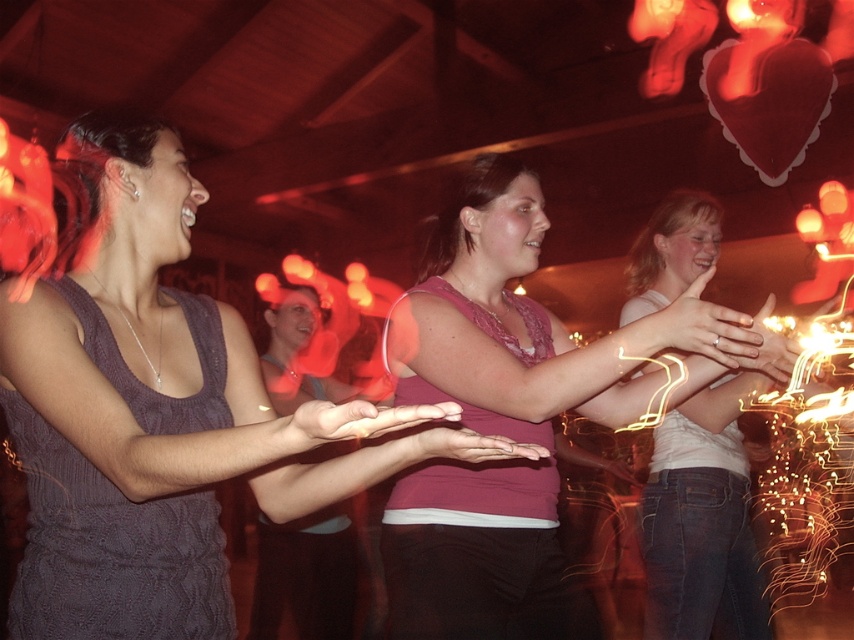
You are at a party and want to take a photo of both the matte purple tank top at center and the pink fabric shirt at center. Which one should you focus on first if you want to capture them in the correct left to right order?

The matte purple tank top at center is positioned on the left side of the pink fabric shirt at center, so you should focus on the matte purple tank top at center first to capture them in the correct left to right order.

In the image, there is a point at coordinates (158, 408). Which object does this point correspond to?

The point at coordinates (158, 408) corresponds to the matte purple tank top at center.

You are at the entrance of the party and want to find the pink fabric shirt at center. Based on the coordinates provided, in which direction should you look to locate it?

The pink fabric shirt at center is located at coordinates point (x=534, y=324), which is in the center of the image. Therefore, you should look straight ahead to find it.